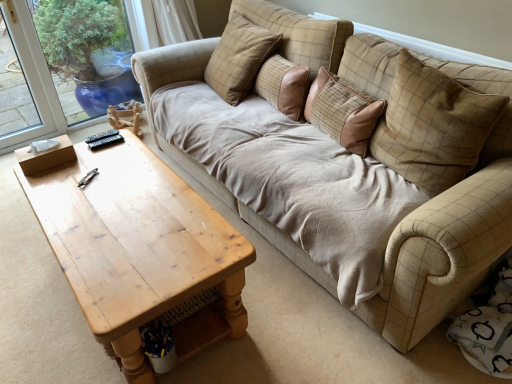
I want to click on free space above light brown wooden coffee table at left (from a real-world perspective), so click(121, 203).